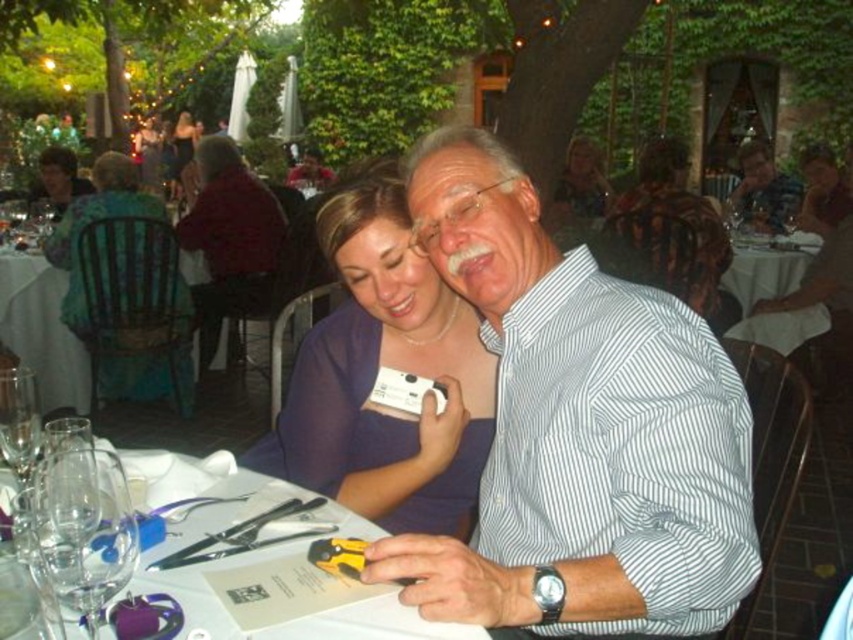
Does clear glassware at center come in front of matte black shirt at center?

Yes, it is.

Is clear glassware at center further to the viewer compared to matte black shirt at center?

That is False.

Find the location of a particular element. This screenshot has height=640, width=853. clear glassware at center is located at coordinates (247, 552).

Where is `clear glassware at center`? The height and width of the screenshot is (640, 853). clear glassware at center is located at coordinates (247, 552).

Describe the element at coordinates (763, 189) in the screenshot. The width and height of the screenshot is (853, 640). I see `smooth purple dress at center` at that location.

Based on the photo, between smooth purple dress at center and matte green dress at upper left, which one has less height?

matte green dress at upper left is shorter.

Between point (740, 163) and point (44, 176), which one is positioned in front?

Point (44, 176)

Where is `smooth purple dress at center`? smooth purple dress at center is located at coordinates (763, 189).

Who is shorter, clear glassware at center or smooth purple dress at center?

clear glassware at center

Which is more to the left, clear glassware at center or smooth purple dress at center?

clear glassware at center is more to the left.

Between point (410, 616) and point (770, 156), which one is positioned behind?

The point (770, 156) is behind.

Identify the location of clear glassware at center. The image size is (853, 640). (247, 552).